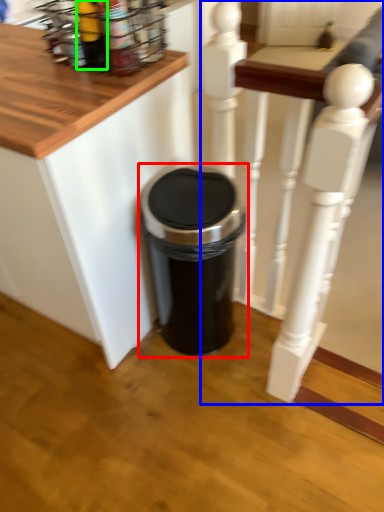
Question: Which is farther away from waste container (highlighted by a red box)? rail (highlighted by a blue box) or bottle (highlighted by a green box)?

Choices:
 (A) rail
 (B) bottle

Answer: (B)